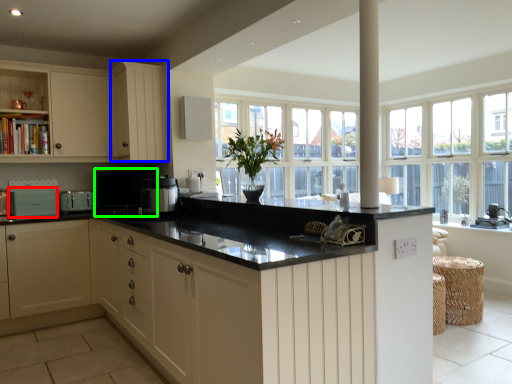
Question: Which object is positioned closest to appliance (highlighted by a red box)? Select from cabinetry (highlighted by a blue box) and appliance (highlighted by a green box).

Choices:
 (A) cabinetry
 (B) appliance

Answer: (B)